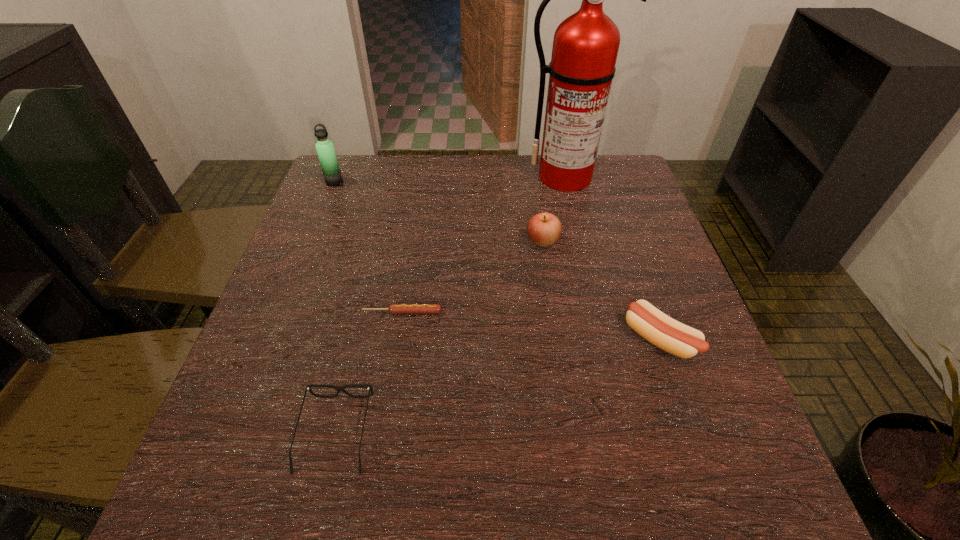
This screenshot has width=960, height=540. In order to click on vacant space at the far right corner of the desktop in this screenshot , I will do `click(632, 170)`.

Where is `vacant space that is in between the shorter sausage and the leftmost object`? vacant space that is in between the shorter sausage and the leftmost object is located at coordinates tap(369, 247).

At what (x,y) coordinates should I click in order to perform the action: click on vacant space in between the fifth tallest object and the leftmost object. Please return your answer as a coordinate pair (x, y). Looking at the image, I should click on (335, 308).

In order to click on empty location between the shorter sausage and the apple in this screenshot , I will do `click(472, 276)`.

Locate an element on the screen. The width and height of the screenshot is (960, 540). blank region between the leftmost object and the taller sausage is located at coordinates (496, 260).

Locate an element on the screen. The height and width of the screenshot is (540, 960). free spot between the right sausage and the nearest object is located at coordinates [497, 386].

At what (x,y) coordinates should I click in order to perform the action: click on free space that is in between the taller sausage and the thermos bottle. Please return your answer as a coordinate pair (x, y). This screenshot has width=960, height=540. Looking at the image, I should click on (496, 260).

What are the coordinates of `vacant area that lies between the apple and the leftmost object` in the screenshot? It's located at (439, 212).

Where is `vacant area between the fire extinguisher and the right sausage`? vacant area between the fire extinguisher and the right sausage is located at coordinates (612, 258).

You are a GUI agent. You are given a task and a screenshot of the screen. Output one action in this format:
    pyautogui.click(x=<x>, y=<y>)
    Task: Click on the empty location between the left sausage and the fourth tallest object
    
    Given the screenshot: What is the action you would take?
    pyautogui.click(x=531, y=325)